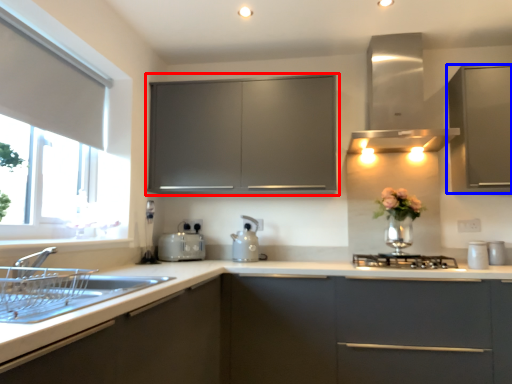
Question: Which point is closer to the camera, cabinetry (highlighted by a red box) or cabinetry (highlighted by a blue box)?

Choices:
 (A) cabinetry
 (B) cabinetry

Answer: (B)